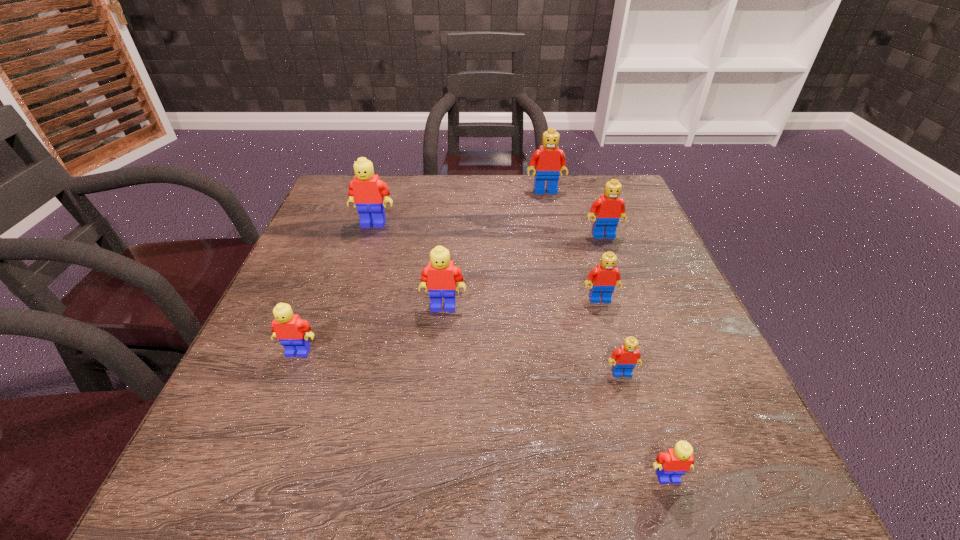
Identify the location of the farthest Lego. (549, 160).

Image resolution: width=960 pixels, height=540 pixels. What are the coordinates of `the biggest red Lego` in the screenshot? It's located at (549, 160).

Where is `the seventh nearest object`? The width and height of the screenshot is (960, 540). the seventh nearest object is located at coordinates (366, 190).

Locate an element on the screen. This screenshot has width=960, height=540. the farthest yellow Lego is located at coordinates (366, 190).

The image size is (960, 540). What are the coordinates of `the second biggest red Lego` in the screenshot? It's located at (609, 208).

The width and height of the screenshot is (960, 540). Identify the location of the second farthest red Lego. (609, 208).

Find the location of a particular element. The image size is (960, 540). the third yellow Lego from left to right is located at coordinates (441, 275).

Locate an element on the screen. The width and height of the screenshot is (960, 540). the third object from left to right is located at coordinates (441, 275).

At what (x,y) coordinates should I click in order to perform the action: click on the third biggest red Lego. Please return your answer as a coordinate pair (x, y). Looking at the image, I should click on (605, 277).

This screenshot has width=960, height=540. I want to click on the third farthest yellow Lego, so click(292, 332).